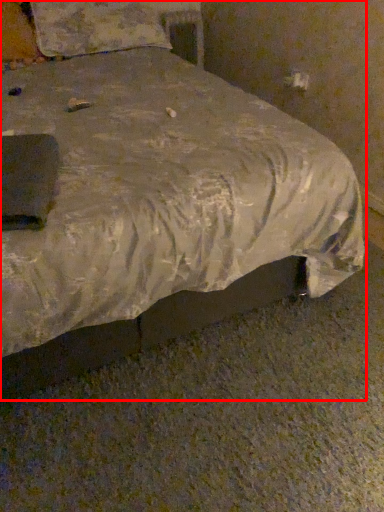
Question: From the image's perspective, what is the correct spatial relationship of bed (annotated by the red box) in relation to pillow?

Choices:
 (A) below
 (B) above

Answer: (A)